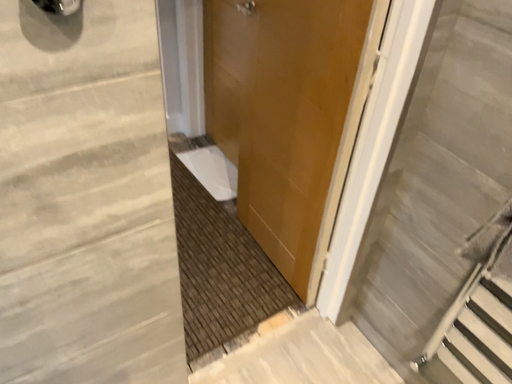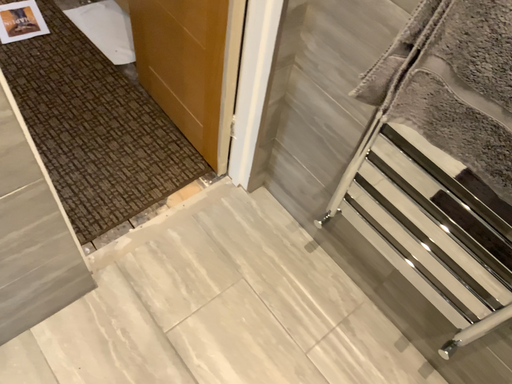
Question: How did the camera likely rotate when shooting the video?

Choices:
 (A) rotated downward
 (B) rotated upward

Answer: (A)